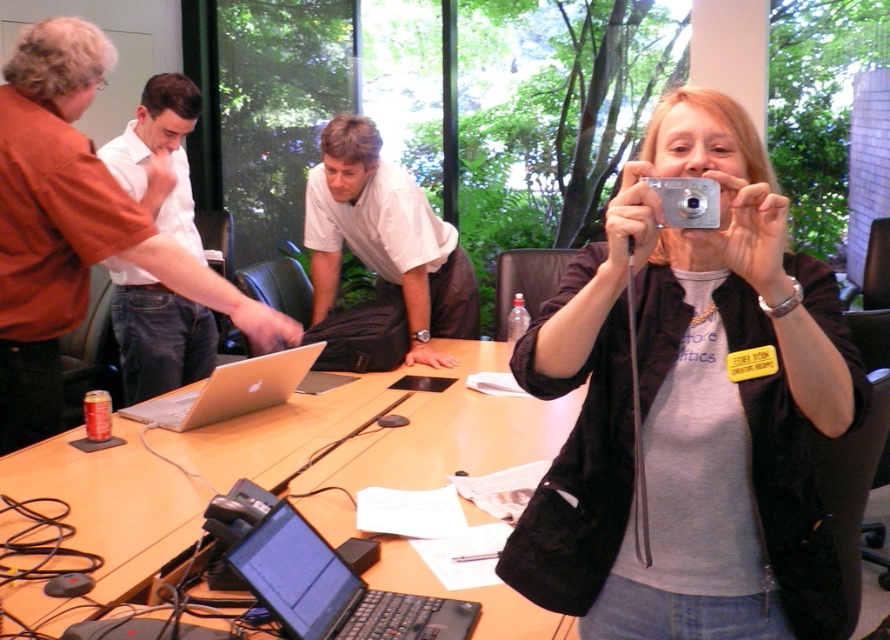
Question: Does white shirt at left lie behind silver metallic camera at upper center?

Choices:
 (A) yes
 (B) no

Answer: (A)

Question: Is wooden table at center positioned before silver metallic camera at upper center?

Choices:
 (A) no
 (B) yes

Answer: (A)

Question: Which point is farther to the camera?

Choices:
 (A) silver metallic camera at center
 (B) silver metallic laptop at center
 (C) white matte shirt at center

Answer: (C)

Question: Which object is farther from the camera taking this photo?

Choices:
 (A) wooden table at center
 (B) silver metallic camera at upper center
 (C) white matte shirt at center

Answer: (C)

Question: Which object is the farthest from the silver metallic laptop at center?

Choices:
 (A) black plastic laptop at lower center
 (B) white shirt at left
 (C) wooden table at center

Answer: (A)

Question: Can you confirm if silver metallic laptop at center is wider than silver metallic camera at upper center?

Choices:
 (A) no
 (B) yes

Answer: (B)